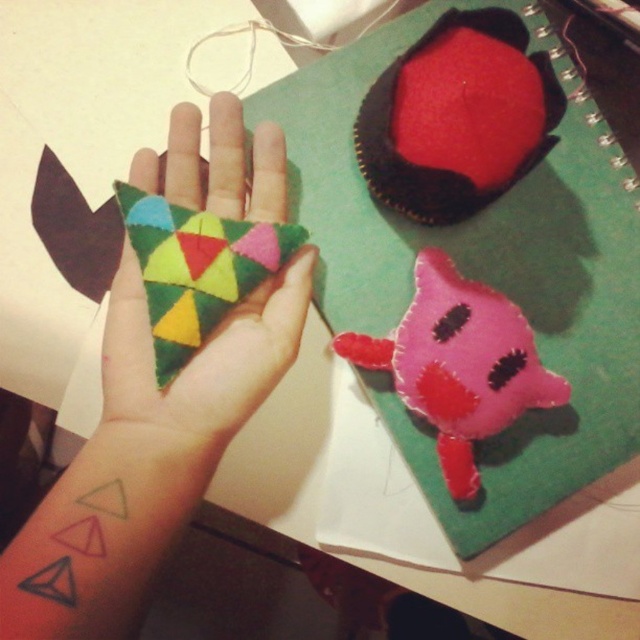
Which is more to the right, felt triangle at center or pink felt plushie at center?

pink felt plushie at center is more to the right.

Does felt triangle at center have a smaller size compared to pink felt plushie at center?

No, felt triangle at center is not smaller than pink felt plushie at center.

What are the coordinates of `felt triangle at center` in the screenshot? It's located at (145, 460).

Find the location of a particular element. felt triangle at center is located at coordinates (145, 460).

Is point (221, 365) positioned behind point (557, 401)?

No.

Which is behind, point (195, 394) or point (408, 380)?

The point (408, 380) is behind.

The width and height of the screenshot is (640, 640). I want to click on multicolored felt triangle at center, so click(x=204, y=353).

Can you confirm if felt triangle at center is smaller than multicolored felt triangle at center?

No.

Does felt triangle at center have a lesser height compared to multicolored felt triangle at center?

No.

I want to click on felt triangle at center, so click(145, 460).

Where is `felt triangle at center`? The width and height of the screenshot is (640, 640). felt triangle at center is located at coordinates (145, 460).